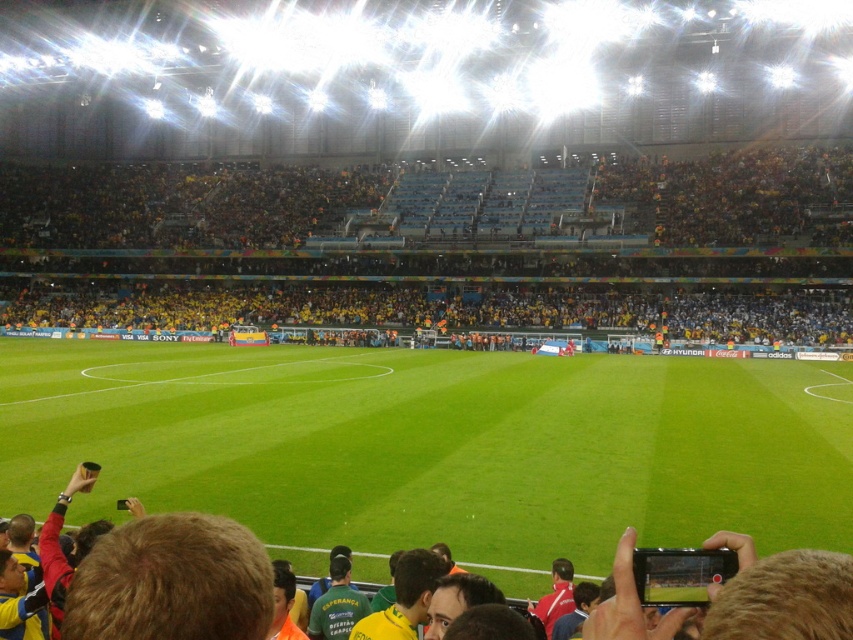
Does green grass at center appear over yellow fabric seats at upper center?

Incorrect, green grass at center is not positioned above yellow fabric seats at upper center.

Does green grass at center appear on the right side of yellow fabric seats at upper center?

Yes, green grass at center is to the right of yellow fabric seats at upper center.

Between point (21, 508) and point (300, 193), which one is positioned behind?

Point (300, 193)

This screenshot has width=853, height=640. Identify the location of green grass at center. coord(436,445).

Image resolution: width=853 pixels, height=640 pixels. In order to click on yellow fabric seats at upper center in this screenshot , I will do click(430, 248).

What do you see at coordinates (430, 248) in the screenshot? This screenshot has width=853, height=640. I see `yellow fabric seats at upper center` at bounding box center [430, 248].

Is point (520, 324) positioned behind point (666, 616)?

Yes.

Locate an element on the screen. Image resolution: width=853 pixels, height=640 pixels. yellow fabric seats at upper center is located at coordinates (430, 248).

Is point (531, 570) farther from viewer compared to point (604, 634)?

Yes, point (531, 570) is farther from viewer.

Between green grass at center and brown leather jacket at lower center, which one appears on the right side from the viewer's perspective?

brown leather jacket at lower center is more to the right.

Which is in front, point (326, 428) or point (239, 525)?

Point (239, 525)

Find the location of `green grass at center`. green grass at center is located at coordinates (436, 445).